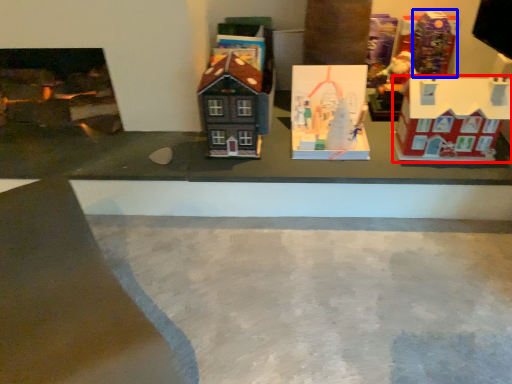
Question: Among these objects, which one is farthest to the camera, toy (highlighted by a red box) or toy (highlighted by a blue box)?

Choices:
 (A) toy
 (B) toy

Answer: (B)